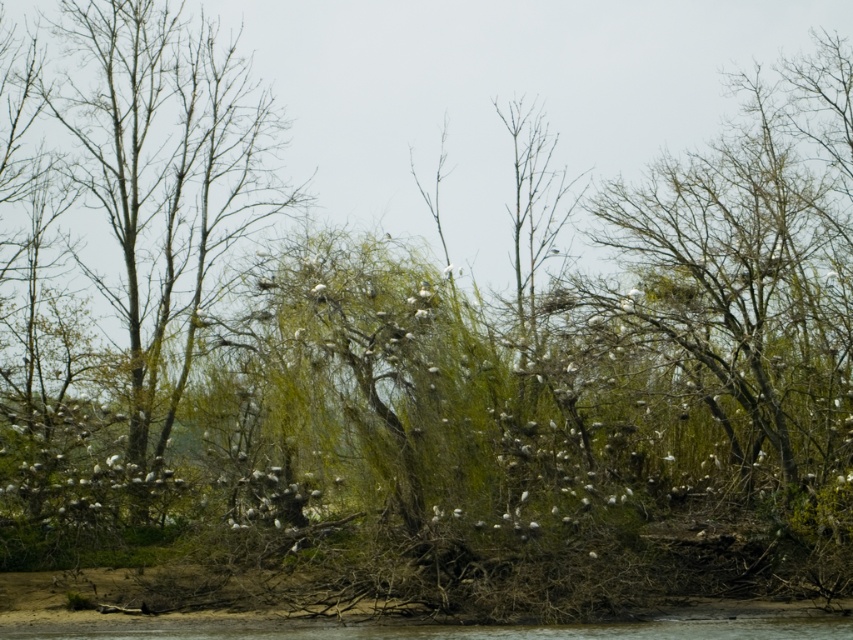
You are standing on the bank and want to take a photo of the bare branches at left and the brown muddy river at lower center. Which object will appear larger in your camera view?

The bare branches at left will appear larger in your camera view because they are taller than the brown muddy river at lower center.

You are an environmental scientist assessing the vegetation coverage in the area. You observe the bare branches at left and the brown muddy river at lower center. Which object occupies a smaller horizontal space in the image?

The bare branches at left has a lesser width compared to the brown muddy river at lower center, so the bare branches at left occupies a smaller horizontal space.